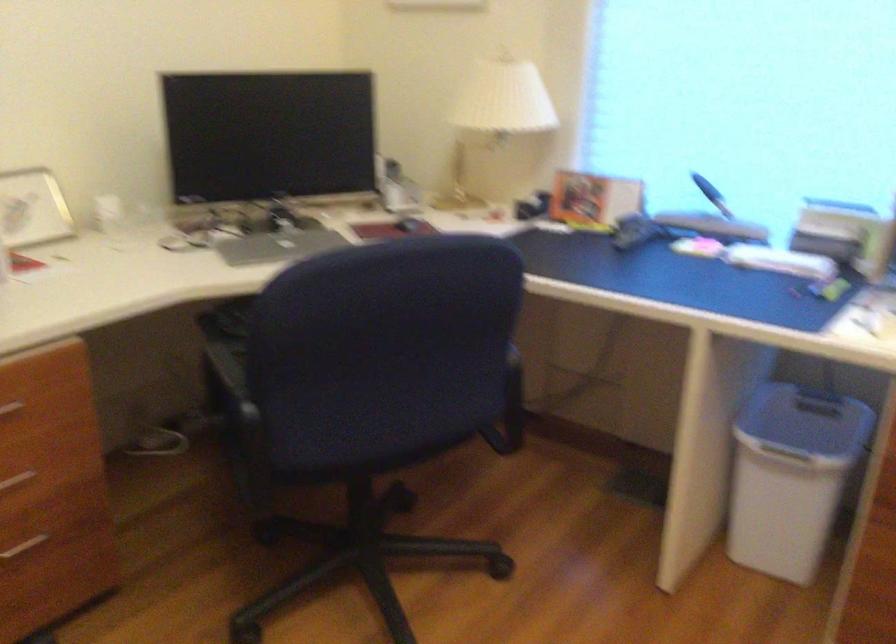
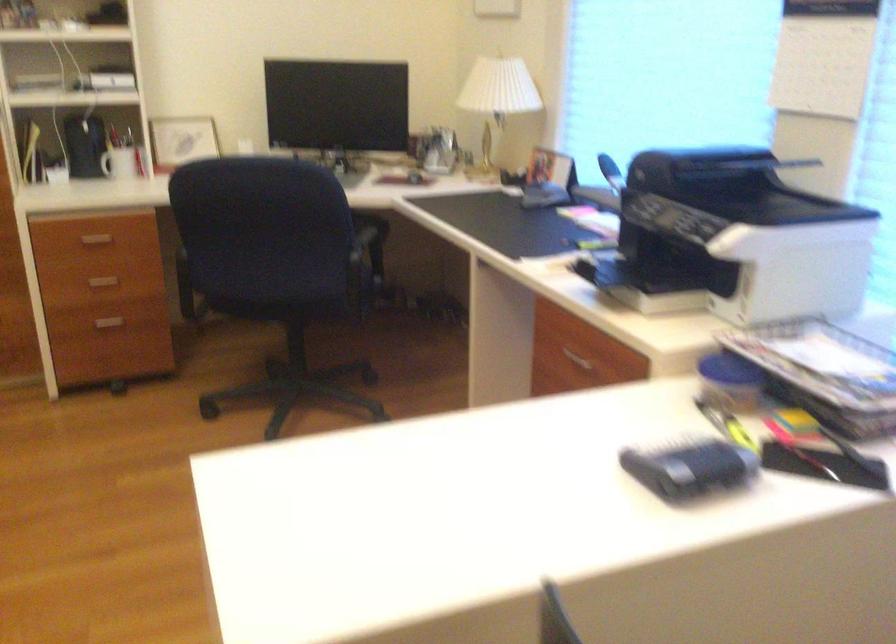
Question: What movement of the cameraman would produce the second image?

Choices:
 (A) Left
 (B) Right
 (C) Forward
 (D) Backward

Answer: (B)